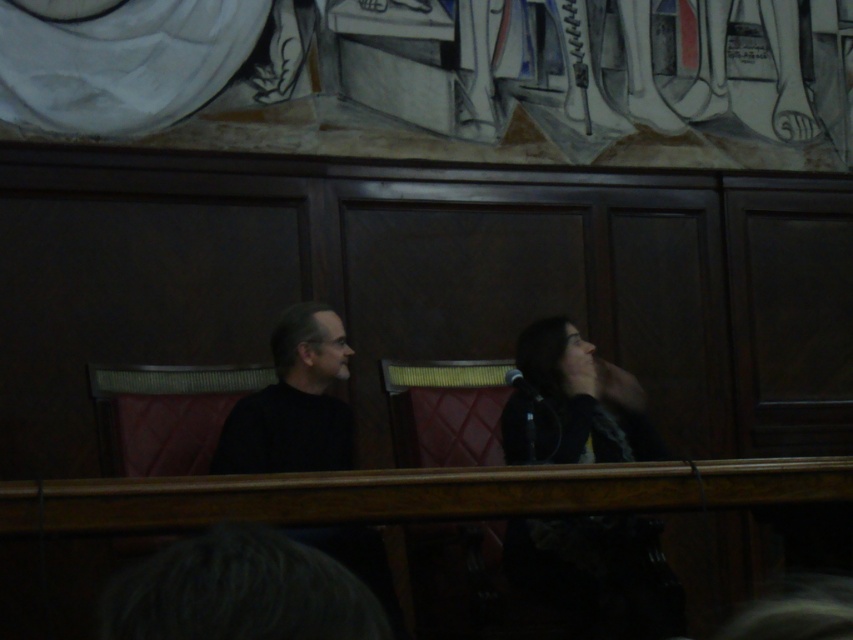
You are designing a layout for a magazine article that requires knowing the relative sizes of the black matte jacket at right and the black matte shirt at left in the image. Which object is taller?

The black matte jacket at right is taller than the black matte shirt at left.

Based on the scene description, where is the black matte jacket at right located in terms of coordinates?

The black matte jacket at right is located at coordinates point [598,572].

You are a photographer setting up for a formal event. You need to ensure that both the black matte jacket at right and the black matte shirt at left are clearly visible in your photo. Given their positions, which one might require more lighting adjustments to ensure visibility?

The black matte shirt at left might require more lighting adjustments because the black matte jacket at right is in front of it, potentially casting shadows or reducing its visibility.